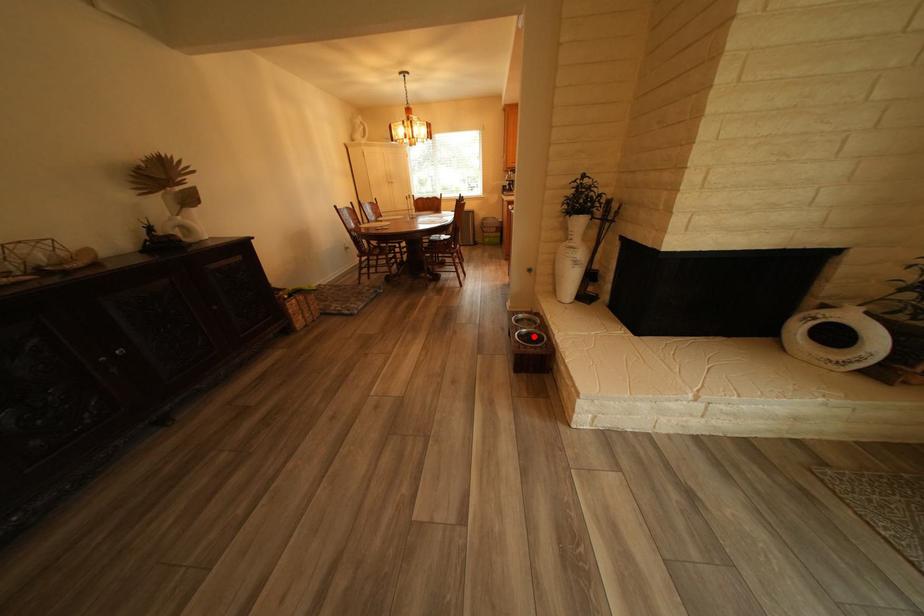
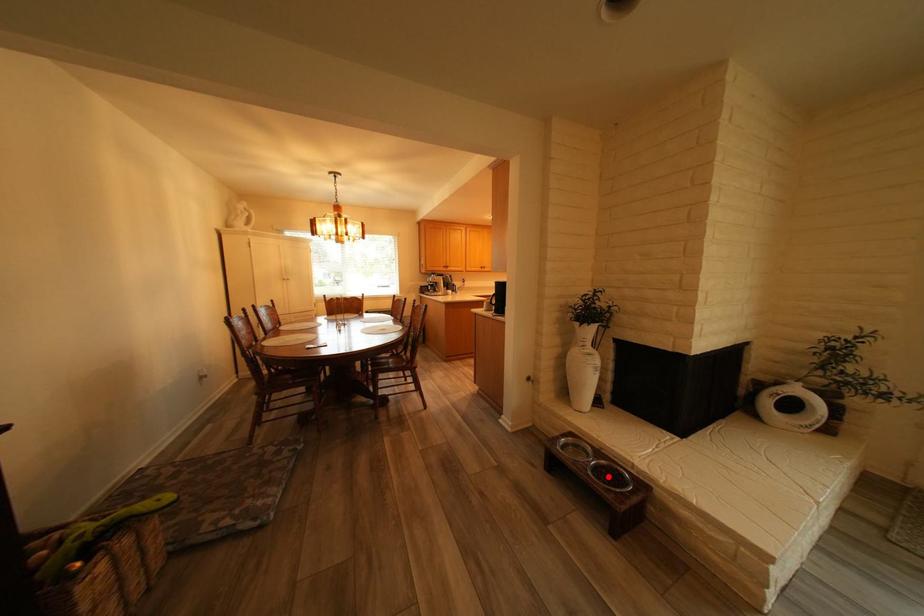
I am providing you with two images of the same scene from different viewpoints. A red point is marked on the first image and another point is marked on the second image. Is the marked point in image1 the same physical position as the marked point in image2?

Yes